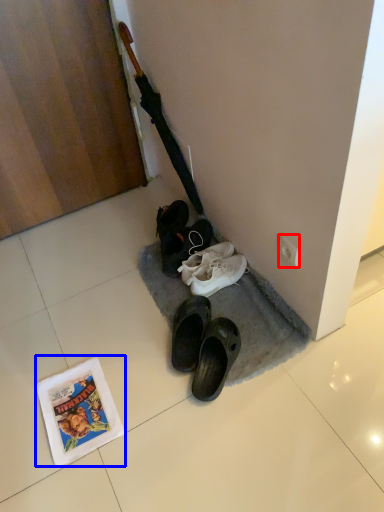
Question: Which point is further to the camera, power outlet (highlighted by a red box) or comic book (highlighted by a blue box)?

Choices:
 (A) power outlet
 (B) comic book

Answer: (A)